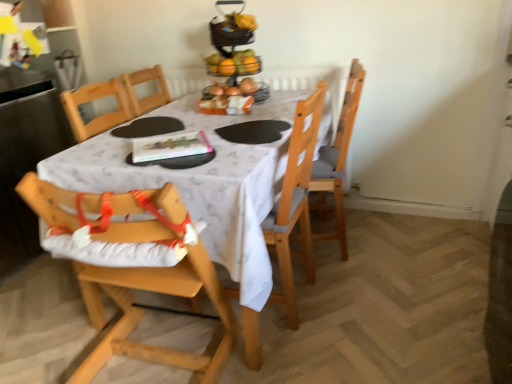
The image size is (512, 384). I want to click on unoccupied region to the right of wooden chair at right, marked as the 3th chair in a left-to-right arrangement, so click(x=390, y=239).